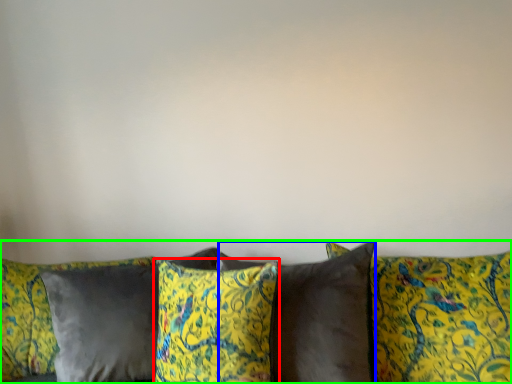
Question: Based on their relative distances, which object is farther from pillow (highlighted by a red box)? Choose from pillow (highlighted by a blue box) and studio couch (highlighted by a green box).

Choices:
 (A) pillow
 (B) studio couch

Answer: (B)